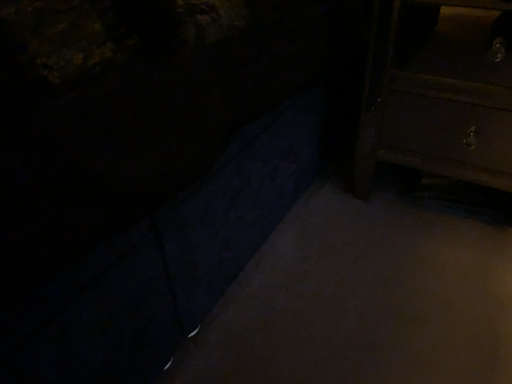
Locate an element on the screen. dark wood drawer at right is located at coordinates (438, 91).

Describe the element at coordinates (438, 91) in the screenshot. I see `dark wood drawer at right` at that location.

Where is `dark wood drawer at right`? dark wood drawer at right is located at coordinates (438, 91).